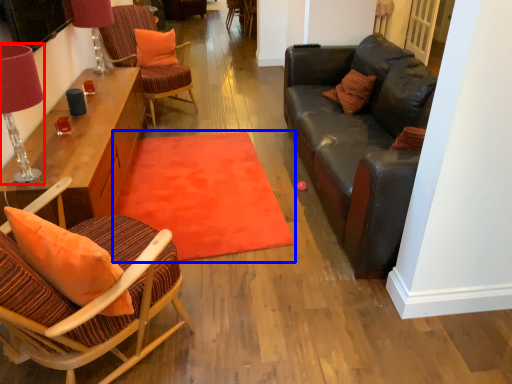
Question: Which of the following is the closest to the observer, table lamp (highlighted by a red box) or mat (highlighted by a blue box)?

Choices:
 (A) table lamp
 (B) mat

Answer: (A)